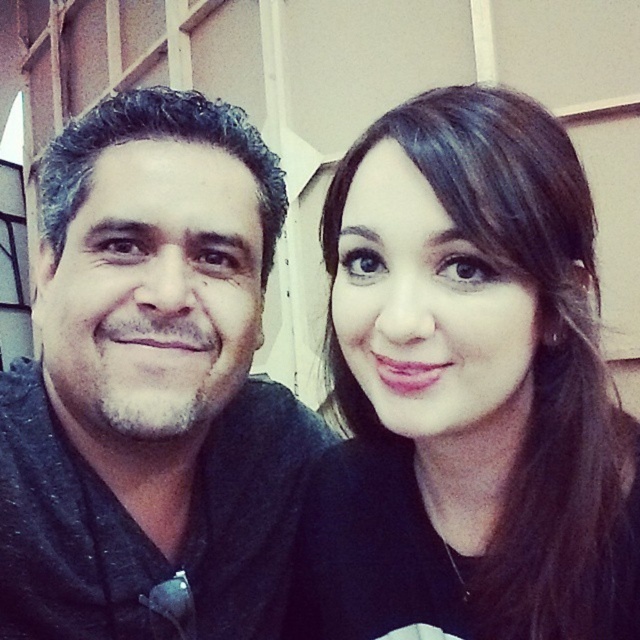
Is point (364, 636) positioned after point (132, 348)?

Yes, point (364, 636) is farther from viewer.

Find the location of a particular element. The width and height of the screenshot is (640, 640). black matte hair at upper right is located at coordinates (467, 392).